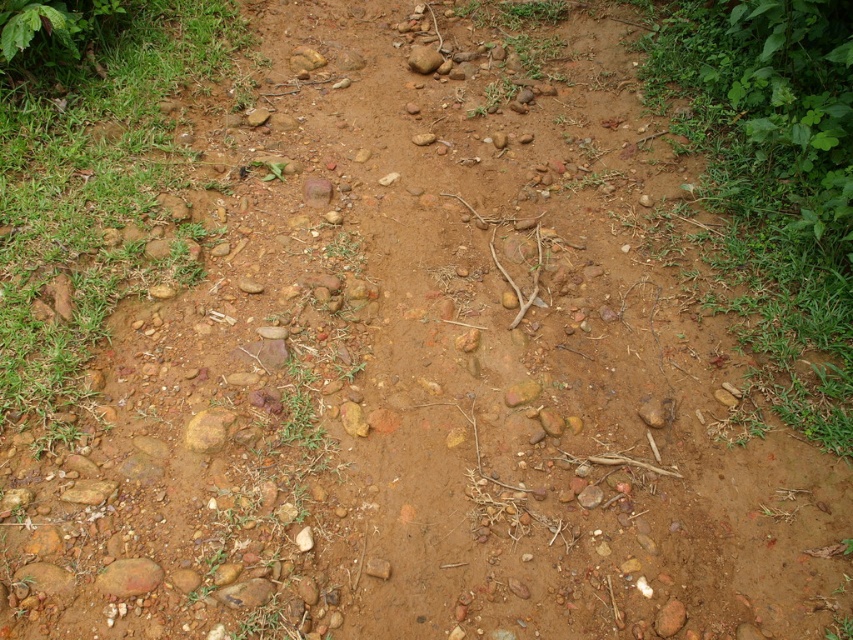
Question: Which point appears farthest from the camera in this image?

Choices:
 (A) (425, 61)
 (B) (146, 576)
 (C) (189, 429)

Answer: (A)

Question: In this image, where is yellow rough stone at center located relative to smooth brown rock at center?

Choices:
 (A) right
 (B) left

Answer: (B)

Question: Does green leafy plant at right appear on the left side of smooth brown rock at center?

Choices:
 (A) yes
 (B) no

Answer: (B)

Question: Is brown rough rock at lower left further to the viewer compared to smooth brown rock at center?

Choices:
 (A) yes
 (B) no

Answer: (B)

Question: Which of these objects is positioned farthest from the smooth brown rock at center?

Choices:
 (A) brown rough rock at lower left
 (B) yellow rough stone at center

Answer: (A)

Question: Which object is positioned closest to the brown rough rock at lower left?

Choices:
 (A) green grass at left
 (B) green leafy plant at right
 (C) smooth brown rock at center
 (D) yellow rough stone at center

Answer: (D)